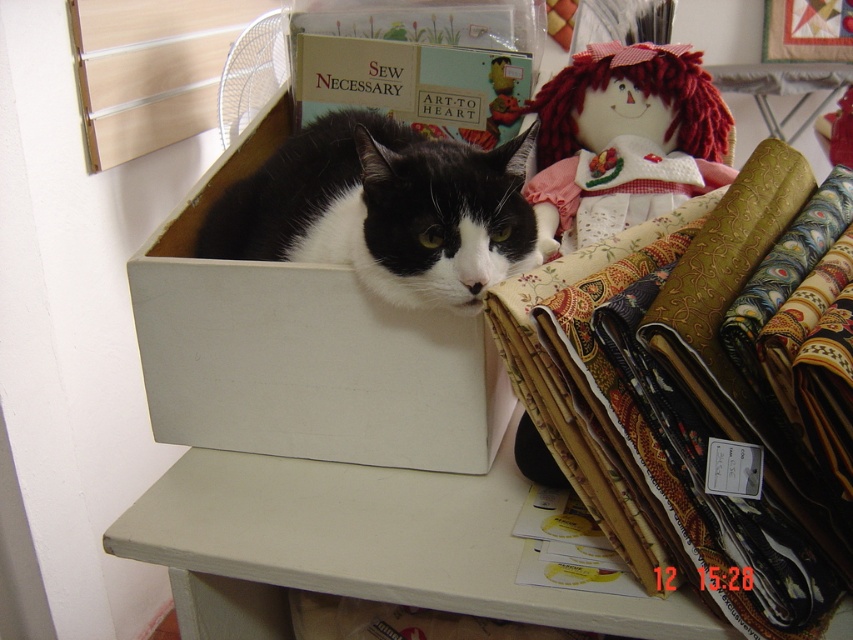
You need to place a rectangular box that is 1.2 meters long on the white matte table at center. Considering the black and white fur cat at center is currently on the table, can the box fit on the table without overhanging the edges?

The white matte table at center might be wider than black and white fur cat at center, but since the cat is on the table, we cannot determine the table dimensions. The box might not fit properly. Please check the table size before placing the box.

You are a small toy mouse that is 2 inches long. You are placed on the white matte table at center. You want to roll towards the black and white fur cat at center. Can you reach the cat without falling off the table?

The distance between the white matte table at center and the black and white fur cat at center is 9.76 inches. Since the mouse is only 2 inches long, it can roll the 9.76 inches to reach the cat without falling off the table.